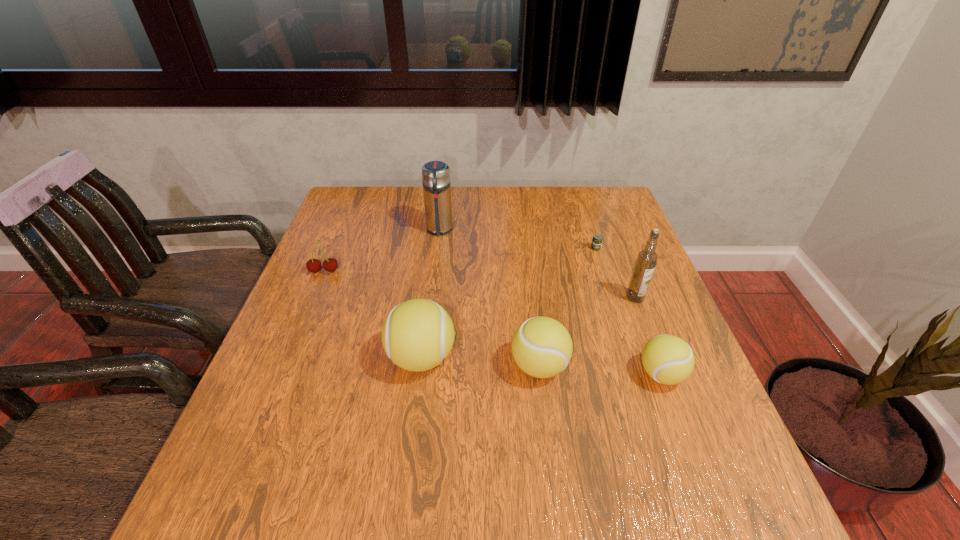
Locate an element on the screen. The width and height of the screenshot is (960, 540). the fourth farthest object is located at coordinates (647, 258).

Find the location of a particular element. vacant space located 0.380m on the back of the third tallest object is located at coordinates (437, 236).

This screenshot has width=960, height=540. What are the coordinates of `free space located 0.390m on the left of the fourth shortest object` in the screenshot? It's located at (328, 366).

Locate an element on the screen. The height and width of the screenshot is (540, 960). vacant space located on the back of the rightmost tennis ball is located at coordinates (x=640, y=319).

Find the location of `vacant point located 0.220m on the surface of the third farthest object`. vacant point located 0.220m on the surface of the third farthest object is located at coordinates (296, 339).

You are a GUI agent. You are given a task and a screenshot of the screen. Output one action in this format:
    pyautogui.click(x=<x>, y=<y>)
    Task: Click on the vacant space located with a handle on the side of the farthest object
    This screenshot has height=540, width=960.
    Given the screenshot: What is the action you would take?
    pyautogui.click(x=427, y=328)

This screenshot has height=540, width=960. What are the coordinates of `free space located on the right of the beer can` in the screenshot? It's located at (639, 248).

The height and width of the screenshot is (540, 960). I want to click on vacant position located 0.090m on the label of the vodka, so click(x=648, y=331).

Where is `object present at the far edge`? object present at the far edge is located at coordinates (436, 182).

Where is `object present at the left edge`? This screenshot has width=960, height=540. object present at the left edge is located at coordinates (313, 265).